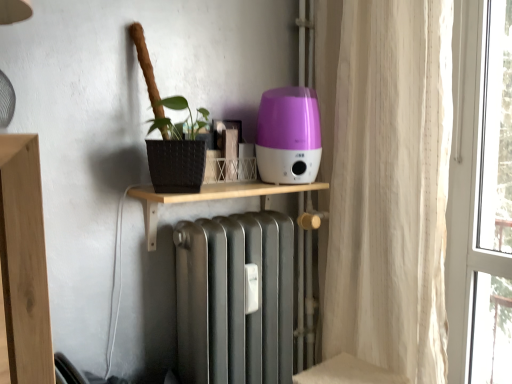
Describe the element at coordinates (288, 136) in the screenshot. The image size is (512, 384). I see `purple glossy humidifier at center` at that location.

Image resolution: width=512 pixels, height=384 pixels. I want to click on wooden shelf at center, so click(210, 198).

Describe the element at coordinates (385, 181) in the screenshot. The width and height of the screenshot is (512, 384). I see `white sheer curtain at right` at that location.

Locate an element on the screen. The height and width of the screenshot is (384, 512). purple glossy humidifier at center is located at coordinates [x=288, y=136].

Is wooden shelf at center at the left side of purple glossy humidifier at center?

Yes.

Is purple glossy humidifier at center surrounded by wooden shelf at center?

No, purple glossy humidifier at center is not inside wooden shelf at center.

Who is more distant, wooden shelf at center or purple glossy humidifier at center?

purple glossy humidifier at center is more distant.

Is white sheer curtain at right to the right of wooden shelf at center from the viewer's perspective?

Correct, you'll find white sheer curtain at right to the right of wooden shelf at center.

Which is behind, point (350, 339) or point (295, 188)?

The point (350, 339) is more distant.

Identify the location of curtain above the wooden shelf at center (from a real-world perspective). (385, 181).

From the image's perspective, which is above, wooden shelf at center or white sheer curtain at right?

white sheer curtain at right appears higher in the image.

How many degrees apart are the facing directions of wooden shelf at center and white sheer curtain at right?

89.9 degrees.

Which of these two, wooden shelf at center or white sheer curtain at right, stands taller?

Standing taller between the two is white sheer curtain at right.

From a real-world perspective, is wooden shelf at center positioned over white sheer curtain at right based on gravity?

No, from a real-world perspective, wooden shelf at center is not over white sheer curtain at right

From the image's perspective, relative to white sheer curtain at right, is purple glossy humidifier at center above or below?

purple glossy humidifier at center is situated higher than white sheer curtain at right in the image.

Considering the positions of objects purple glossy humidifier at center and white sheer curtain at right in the image provided, who is more to the left, purple glossy humidifier at center or white sheer curtain at right?

purple glossy humidifier at center is more to the left.

What are the coordinates of `curtain lying below the purple glossy humidifier at center (from the image's perspective)` in the screenshot? It's located at (385, 181).

Would you say purple glossy humidifier at center is outside white sheer curtain at right?

purple glossy humidifier at center lies outside white sheer curtain at right's area.

Considering the relative sizes of purple glossy humidifier at center and wooden shelf at center in the image provided, is purple glossy humidifier at center wider than wooden shelf at center?

No.

Is the position of purple glossy humidifier at center more distant than that of wooden shelf at center?

That is True.

Considering the relative sizes of purple glossy humidifier at center and wooden shelf at center in the image provided, is purple glossy humidifier at center taller than wooden shelf at center?

Correct, purple glossy humidifier at center is much taller as wooden shelf at center.

Based on the photo, is purple glossy humidifier at center positioned far away from wooden shelf at center?

Actually, purple glossy humidifier at center and wooden shelf at center are a little close together.

Would you say purple glossy humidifier at center is part of white sheer curtain at right's contents?

No, purple glossy humidifier at center is not inside white sheer curtain at right.

Can you confirm if white sheer curtain at right is taller than purple glossy humidifier at center?

Indeed, white sheer curtain at right has a greater height compared to purple glossy humidifier at center.

The image size is (512, 384). I want to click on shelf lying in front of the purple glossy humidifier at center, so click(x=210, y=198).

In the image, there is a white sheer curtain at right. Where is `shelf below it (from a real-world perspective)`? Image resolution: width=512 pixels, height=384 pixels. shelf below it (from a real-world perspective) is located at coordinates (210, 198).

Looking at the image, which one is located further to wooden shelf at center, purple glossy humidifier at center or white sheer curtain at right?

white sheer curtain at right lies further to wooden shelf at center than the other object.

Which object lies further to the anchor point white sheer curtain at right, wooden shelf at center or purple glossy humidifier at center?

Among the two, wooden shelf at center is located further to white sheer curtain at right.

Estimate the real-world distances between objects in this image. Which object is further from purple glossy humidifier at center, wooden shelf at center or white sheer curtain at right?

white sheer curtain at right.

Considering their positions, is white sheer curtain at right positioned further to purple glossy humidifier at center than wooden shelf at center?

white sheer curtain at right.

Considering their positions, is white sheer curtain at right positioned closer to wooden shelf at center than purple glossy humidifier at center?

The object closer to wooden shelf at center is purple glossy humidifier at center.

Which object lies further to the anchor point white sheer curtain at right, purple glossy humidifier at center or wooden shelf at center?

Among the two, wooden shelf at center is located further to white sheer curtain at right.

Identify the location of appliance located between wooden shelf at center and white sheer curtain at right in the left-right direction. (288, 136).